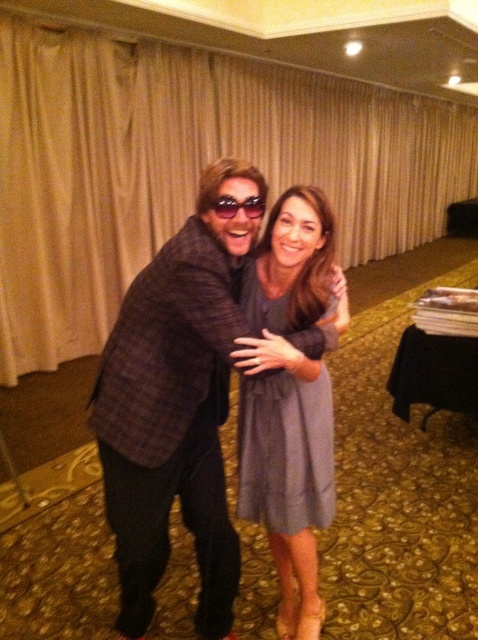
Question: Which object is positioned farthest from the beige fabric curtain at upper center?

Choices:
 (A) gray satin dress at center
 (B) plaid fabric jacket at center

Answer: (A)

Question: Which object appears closest to the camera in this image?

Choices:
 (A) sunglasses at center
 (B) gray satin dress at center

Answer: (B)

Question: Can you confirm if gray satin dress at center is smaller than sunglasses at center?

Choices:
 (A) no
 (B) yes

Answer: (A)

Question: Which point is closer to the camera?

Choices:
 (A) gray satin dress at center
 (B) plaid fabric jacket at center
 (C) beige fabric curtain at upper center
 (D) sunglasses at center

Answer: (B)

Question: Is plaid fabric jacket at center below gray satin dress at center?

Choices:
 (A) yes
 (B) no

Answer: (A)

Question: Can you confirm if beige fabric curtain at upper center is positioned below gray satin dress at center?

Choices:
 (A) yes
 (B) no

Answer: (B)